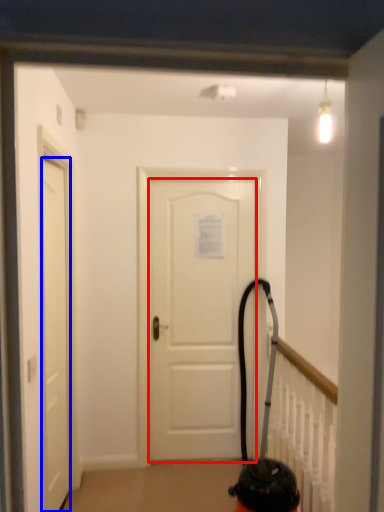
Question: Among these objects, which one is farthest to the camera, door (highlighted by a red box) or door (highlighted by a blue box)?

Choices:
 (A) door
 (B) door

Answer: (A)